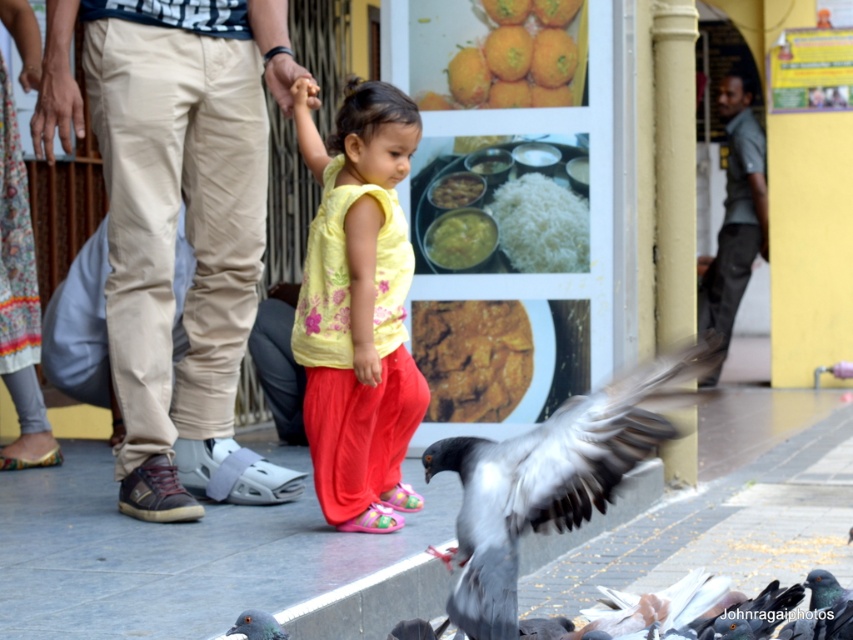
Question: Can you confirm if matte yellow blouse at center is positioned to the right of brown crumbly bread at center?

Choices:
 (A) yes
 (B) no

Answer: (B)

Question: Which of these objects is positioned farthest from the gray feathered pigeon at lower left?

Choices:
 (A) white matte rice at center
 (B) matte yellow blouse at center
 (C) green matte curry at center

Answer: (C)

Question: Which object is the farthest from the gray feathered bird at lower right?

Choices:
 (A) white matte rice at center
 (B) gray feathered pigeon at lower left
 (C) green matte curry at center
 (D) floral-patterned fabric at left

Answer: (D)

Question: Does brown crumbly bread at center have a larger size compared to yellowish matte rice at center?

Choices:
 (A) yes
 (B) no

Answer: (A)

Question: Which point is closer to the camera?

Choices:
 (A) yellowish matte rice at center
 (B) brown crumbly bread at center

Answer: (B)

Question: Does matte yellow blouse at center appear on the right side of floral-patterned fabric at left?

Choices:
 (A) yes
 (B) no

Answer: (A)